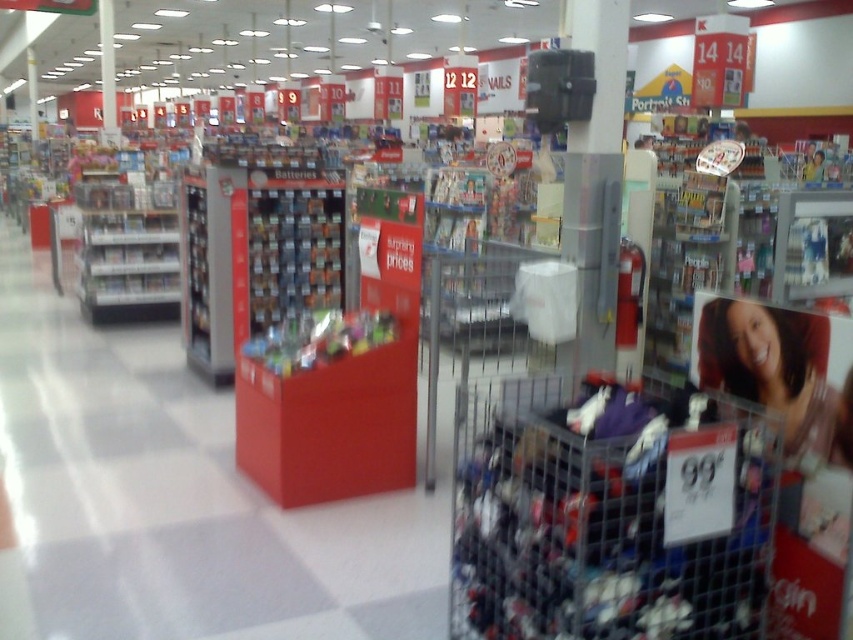
Between metallic silver shopping cart at lower right and smooth plastic photo at center, which one has more height?

With more height is metallic silver shopping cart at lower right.

Between metallic silver shopping cart at lower right and smooth plastic photo at center, which one appears on the left side from the viewer's perspective?

metallic silver shopping cart at lower right

Where is `metallic silver shopping cart at lower right`? The height and width of the screenshot is (640, 853). metallic silver shopping cart at lower right is located at coordinates (610, 516).